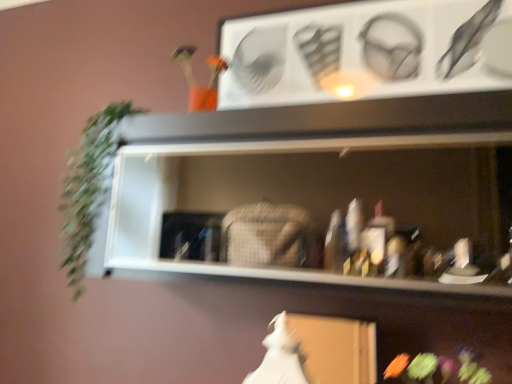
Consider the image. Measure the distance between point (x=444, y=111) and camera.

A distance of 38.35 inches exists between point (x=444, y=111) and camera.

Measure the distance between white matte shelf at center and camera.

They are 35.05 inches apart.

Describe the element at coordinates (419, 368) in the screenshot. I see `fluffy fabric flower at lower right` at that location.

Locate an element on the screen. This screenshot has width=512, height=384. white matte fancy dress at lower center is located at coordinates (279, 357).

The height and width of the screenshot is (384, 512). Identify the location of white matte shelf at center. (328, 213).

Considering the relative positions of green leafy plant at left and fluffy fabric flower at lower right in the image provided, is green leafy plant at left to the left or to the right of fluffy fabric flower at lower right?

From the image, it's evident that green leafy plant at left is to the left of fluffy fabric flower at lower right.

Is fluffy fabric flower at lower right a part of green leafy plant at left?

No, fluffy fabric flower at lower right is located outside of green leafy plant at left.

How far apart are green leafy plant at left and fluffy fabric flower at lower right?

37.95 inches.

Is point (76, 201) closer or farther from the camera than point (404, 380)?

Point (76, 201).

Can you tell me how much green leafy plant at left and white matte shelf at center differ in facing direction?

1.69 degrees separate the facing orientations of green leafy plant at left and white matte shelf at center.

Is point (101, 130) positioned in front of point (385, 142)?

No, (101, 130) is further to viewer.

Looking at this image, can you confirm if green leafy plant at left is smaller than white matte shelf at center?

Indeed, green leafy plant at left has a smaller size compared to white matte shelf at center.

What are the coordinates of `plant located on the left of white matte shelf at center` in the screenshot? It's located at (88, 188).

From the image's perspective, which object appears higher, fluffy fabric flower at lower right or green leafy plant at left?

green leafy plant at left, from the image's perspective.

From a real-world perspective, which is physically above, fluffy fabric flower at lower right or green leafy plant at left?

In real-world perspective, green leafy plant at left is above.

In the scene shown: Are fluffy fabric flower at lower right and green leafy plant at left far apart?

No, fluffy fabric flower at lower right is not far away from green leafy plant at left.

At what (x,y) coordinates should I click in order to perform the action: click on shelf in front of the fluffy fabric flower at lower right. Please return your answer as a coordinate pair (x, y). The image size is (512, 384). Looking at the image, I should click on (328, 213).

Is fluffy fabric flower at lower right inside or outside of white matte shelf at center?

fluffy fabric flower at lower right is not enclosed by white matte shelf at center.

From a real-world perspective, which is physically above, fluffy fabric flower at lower right or white matte shelf at center?

white matte shelf at center.

Does white matte shelf at center lie behind fluffy fabric flower at lower right?

No, white matte shelf at center is closer to the camera.

Is white matte shelf at center turned away from fluffy fabric flower at lower right?

No, white matte shelf at center is not facing the opposite direction of fluffy fabric flower at lower right.

Can you confirm if white matte shelf at center is positioned to the right of fluffy fabric flower at lower right?

Incorrect, white matte shelf at center is not on the right side of fluffy fabric flower at lower right.

Looking at this image, is white matte shelf at center shorter than fluffy fabric flower at lower right?

Incorrect, the height of white matte shelf at center does not fall short of that of fluffy fabric flower at lower right.

Can you confirm if green leafy plant at left is positioned to the left of white matte fancy dress at lower center?

Correct, you'll find green leafy plant at left to the left of white matte fancy dress at lower center.

In the scene shown: Can you tell me how much green leafy plant at left and white matte fancy dress at lower center differ in facing direction?

The angular difference between green leafy plant at left and white matte fancy dress at lower center is 10.5 degrees.

Considering the sizes of objects green leafy plant at left and white matte fancy dress at lower center in the image provided, who is bigger, green leafy plant at left or white matte fancy dress at lower center?

With larger size is green leafy plant at left.

Who is more distant, green leafy plant at left or white matte fancy dress at lower center?

green leafy plant at left is further from the camera.

Who is smaller, white matte shelf at center or white matte fancy dress at lower center?

white matte fancy dress at lower center is smaller.

Considering the relative positions of white matte shelf at center and white matte fancy dress at lower center in the image provided, is white matte shelf at center to the right of white matte fancy dress at lower center from the viewer's perspective?

Yes, white matte shelf at center is to the right of white matte fancy dress at lower center.

Can you see white matte shelf at center touching white matte fancy dress at lower center?

white matte shelf at center is not next to white matte fancy dress at lower center, and they're not touching.

The width and height of the screenshot is (512, 384). I want to click on flower below the green leafy plant at left (from the image's perspective), so click(x=419, y=368).

The width and height of the screenshot is (512, 384). I want to click on shelf lying on the right of green leafy plant at left, so click(x=328, y=213).

Estimate the real-world distances between objects in this image. Which object is closer to green leafy plant at left, white matte fancy dress at lower center or white matte shelf at center?

white matte shelf at center.

Looking at the image, which one is located closer to white matte shelf at center, green leafy plant at left or white matte fancy dress at lower center?

white matte fancy dress at lower center is positioned closer to the anchor white matte shelf at center.

From the image, which object appears to be nearer to fluffy fabric flower at lower right, green leafy plant at left or white matte fancy dress at lower center?

The object closer to fluffy fabric flower at lower right is white matte fancy dress at lower center.

Based on the photo, which object lies nearer to the anchor point green leafy plant at left, white matte shelf at center or fluffy fabric flower at lower right?

white matte shelf at center.

Looking at the image, which one is located further to fluffy fabric flower at lower right, white matte fancy dress at lower center or green leafy plant at left?

green leafy plant at left is further to fluffy fabric flower at lower right.

Looking at the image, which one is located closer to fluffy fabric flower at lower right, white matte shelf at center or white matte fancy dress at lower center?

Based on the image, white matte fancy dress at lower center appears to be nearer to fluffy fabric flower at lower right.

Based on their spatial positions, is green leafy plant at left or white matte shelf at center further from white matte fancy dress at lower center?

The object further to white matte fancy dress at lower center is green leafy plant at left.

Based on their spatial positions, is fluffy fabric flower at lower right or white matte fancy dress at lower center further from green leafy plant at left?

fluffy fabric flower at lower right lies further to green leafy plant at left than the other object.

Find the location of a particular element. The width and height of the screenshot is (512, 384). fancy dress between green leafy plant at left and white matte shelf at center from left to right is located at coordinates (279, 357).

You are a GUI agent. You are given a task and a screenshot of the screen. Output one action in this format:
    pyautogui.click(x=<x>, y=<y>)
    Task: Click on the shelf between green leafy plant at left and fluffy fabric flower at lower right in the horizontal direction
    The width and height of the screenshot is (512, 384).
    Given the screenshot: What is the action you would take?
    pyautogui.click(x=328, y=213)

Find the location of a particular element. fancy dress between white matte shelf at center and fluffy fabric flower at lower right in the up-down direction is located at coordinates (279, 357).

You are a GUI agent. You are given a task and a screenshot of the screen. Output one action in this format:
    pyautogui.click(x=<x>, y=<y>)
    Task: Click on the fancy dress between green leafy plant at left and fluffy fabric flower at lower right from left to right
    Image resolution: width=512 pixels, height=384 pixels.
    Given the screenshot: What is the action you would take?
    pyautogui.click(x=279, y=357)